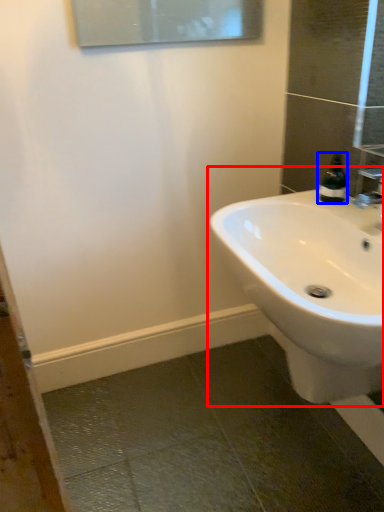
Question: Which object is closer to the camera taking this photo, sink (highlighted by a red box) or soap dispenser (highlighted by a blue box)?

Choices:
 (A) sink
 (B) soap dispenser

Answer: (A)